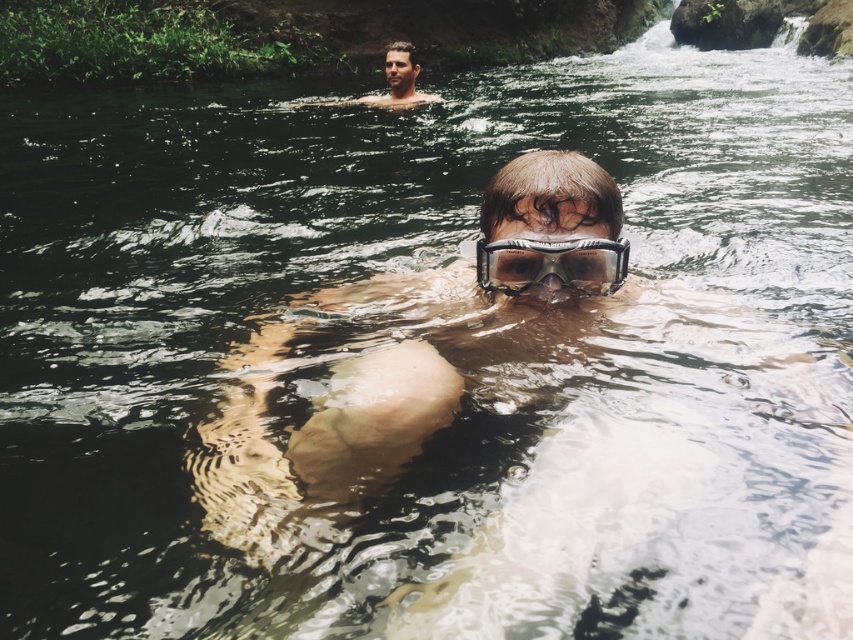
Question: Does clear plastic goggles at center have a greater width compared to transparent plastic goggles at center?

Choices:
 (A) no
 (B) yes

Answer: (B)

Question: Which is nearer to the transparent plastic goggles at center?

Choices:
 (A) smooth skin man at upper center
 (B) clear plastic goggles at center

Answer: (B)

Question: Does transparent plastic goggles at center have a smaller size compared to smooth skin man at upper center?

Choices:
 (A) no
 (B) yes

Answer: (B)

Question: Which object is the closest to the smooth skin man at upper center?

Choices:
 (A) clear plastic goggles at center
 (B) transparent plastic goggles at center

Answer: (A)

Question: Which point is closer to the camera?

Choices:
 (A) smooth skin man at upper center
 (B) clear plastic goggles at center
 (C) transparent plastic goggles at center

Answer: (B)

Question: Is clear plastic goggles at center to the right of smooth skin man at upper center from the viewer's perspective?

Choices:
 (A) no
 (B) yes

Answer: (B)